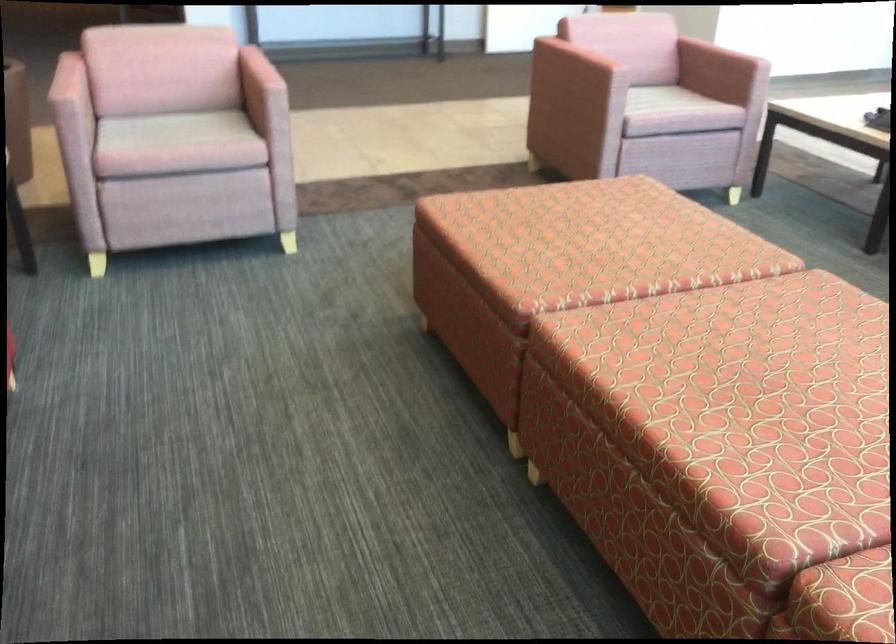
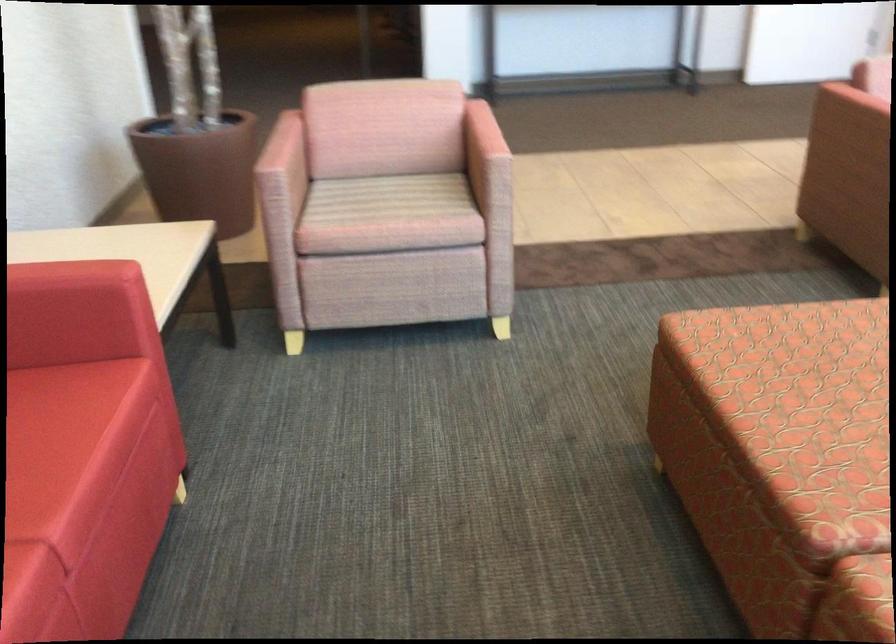
The point at (176, 129) is marked in the first image. Where is the corresponding point in the second image?

(389, 198)